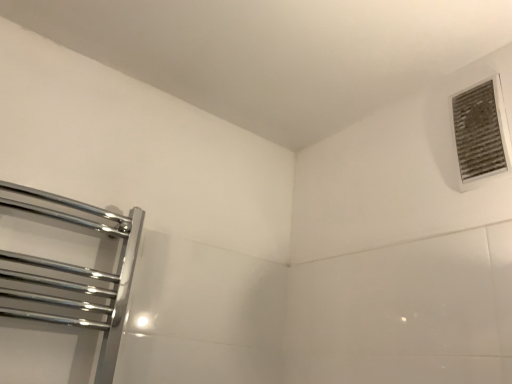
Question: Is chrome/metallic towel rack at left taller or shorter than white textured vent at upper right?

Choices:
 (A) short
 (B) tall

Answer: (B)

Question: In terms of width, does chrome/metallic towel rack at left look wider or thinner when compared to white textured vent at upper right?

Choices:
 (A) thin
 (B) wide

Answer: (B)

Question: Is chrome/metallic towel rack at left bigger or smaller than white textured vent at upper right?

Choices:
 (A) big
 (B) small

Answer: (A)

Question: Considering their positions, is white textured vent at upper right located in front of or behind chrome/metallic towel rack at left?

Choices:
 (A) front
 (B) behind

Answer: (B)

Question: Based on their positions, is white textured vent at upper right located to the left or right of chrome/metallic towel rack at left?

Choices:
 (A) left
 (B) right

Answer: (B)

Question: Is white textured vent at upper right inside the boundaries of chrome/metallic towel rack at left, or outside?

Choices:
 (A) inside
 (B) outside

Answer: (B)

Question: Is point (490, 102) positioned closer to the camera than point (128, 289)?

Choices:
 (A) farther
 (B) closer

Answer: (B)